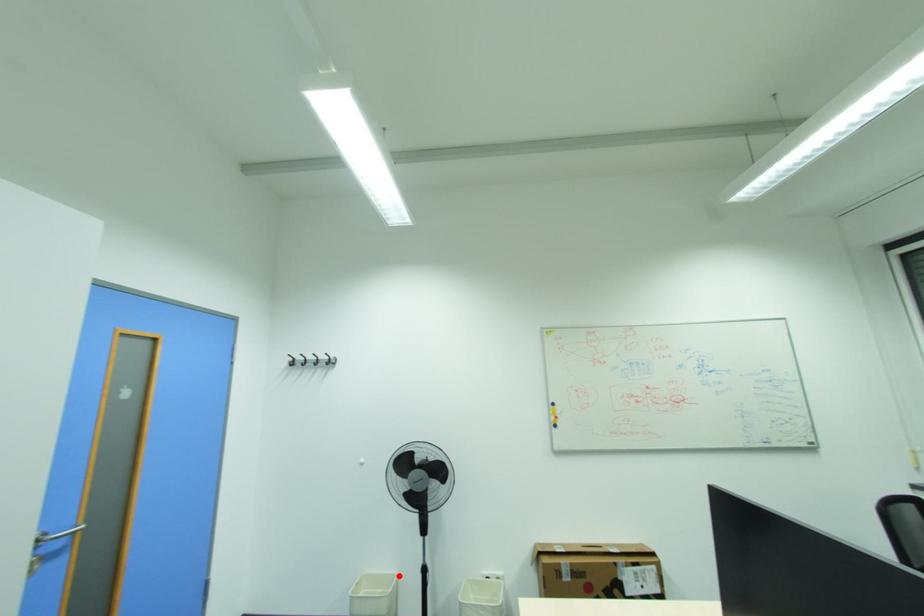
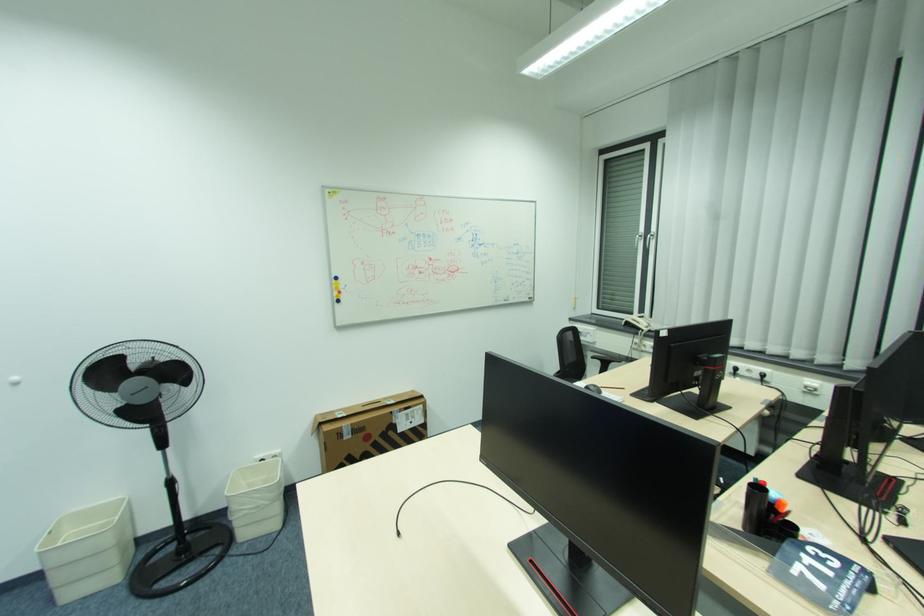
Find the pixel in the second image that matches the highlighted location in the first image.

(128, 500)